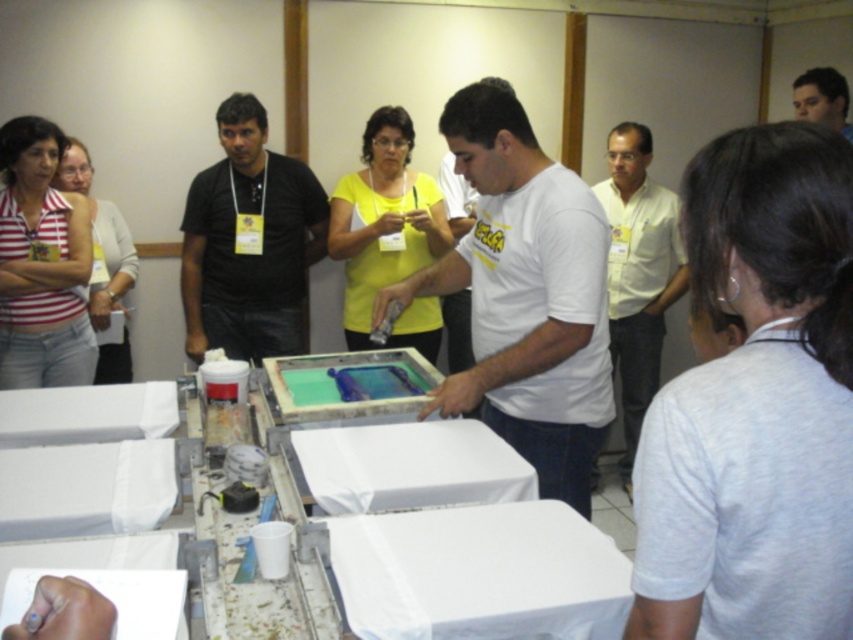
You are standing in the room and want to locate the black matte shirt at center. According to the coordinates given, where would you look relative to the center of the image?

The black matte shirt at center is located at coordinates 0.380 on the x axis and 0.293 on the y axis, which is slightly to the right and above the center point of the image.

You are a photographer standing 2 meters away from the black matte shirt at center and smooth skin face at upper right. Can you fit both subjects into a single photo without moving your position? Explain your reasoning.

The black matte shirt at center and smooth skin face at upper right are 1.90 meters apart. Since the photographer is 2 meters away from both subjects, the distance between them is less than the photographer distance, so yes, both subjects can be captured in a single photo without moving.